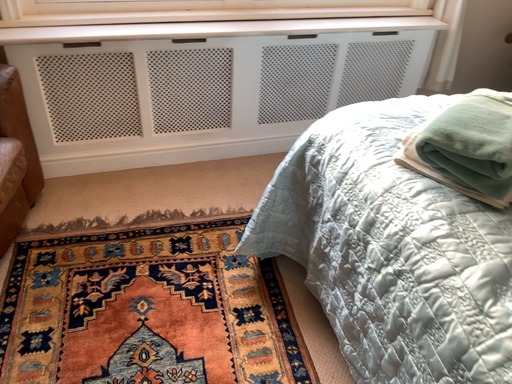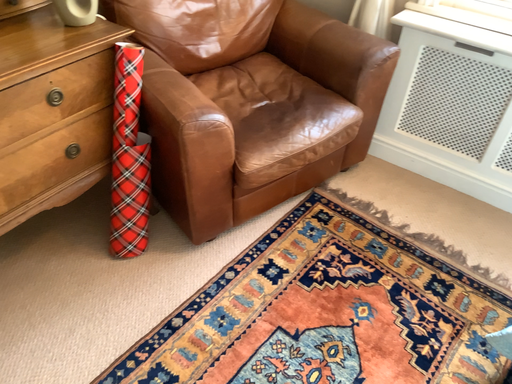
Question: Which way did the camera rotate in the video?

Choices:
 (A) rotated upward
 (B) rotated downward

Answer: (A)